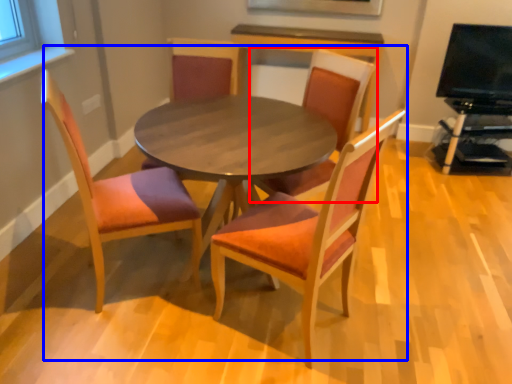
Question: Which object is further to the camera taking this photo, chair (highlighted by a red box) or kitchen & dining room table (highlighted by a blue box)?

Choices:
 (A) chair
 (B) kitchen & dining room table

Answer: (A)